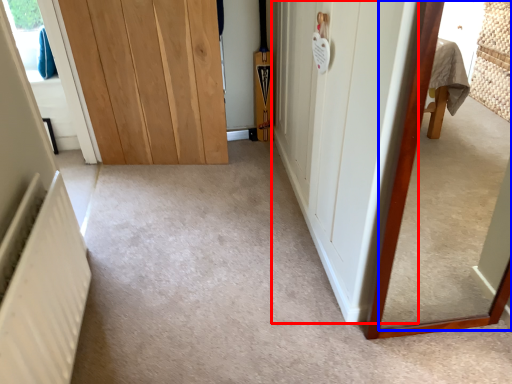
Question: Which of the following is the farthest to the observer, door (highlighted by a red box) or mirror (highlighted by a blue box)?

Choices:
 (A) door
 (B) mirror

Answer: (A)